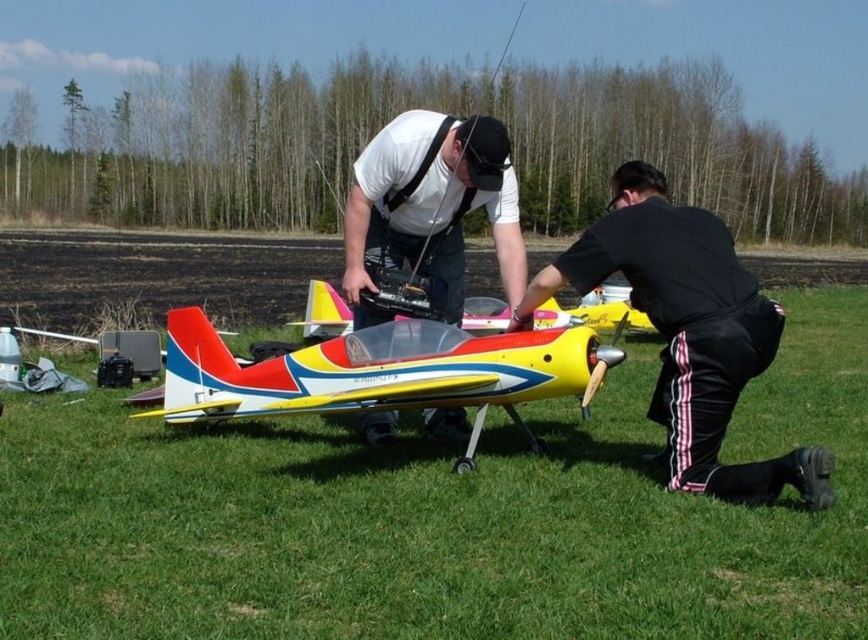
Question: Considering the real-world distances, which object is farthest from the black matte pants at lower right?

Choices:
 (A) matte white shirt at center
 (B) green grass at lower center
 (C) shiny plastic airplane at center

Answer: (B)

Question: Which of these objects is positioned closest to the green grass at lower center?

Choices:
 (A) matte white shirt at center
 (B) shiny plastic airplane at center

Answer: (B)

Question: Does green grass at lower center have a greater width compared to black matte pants at lower right?

Choices:
 (A) yes
 (B) no

Answer: (B)

Question: Where is green grass at lower center located in relation to shiny plastic airplane at center in the image?

Choices:
 (A) right
 (B) left

Answer: (B)

Question: Can you confirm if green grass at lower center is positioned to the right of shiny plastic airplane at center?

Choices:
 (A) no
 (B) yes

Answer: (A)

Question: Which is nearer to the matte white shirt at center?

Choices:
 (A) green grass at lower center
 (B) black matte pants at lower right
 (C) shiny plastic airplane at center

Answer: (C)